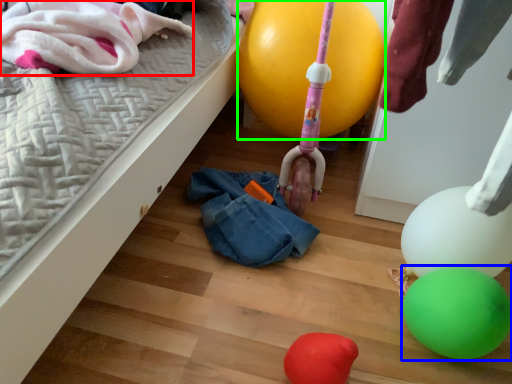
Question: Which object is positioned closest to clothing (highlighted by a red box)? Select from balloon (highlighted by a blue box) and balloon (highlighted by a green box).

Choices:
 (A) balloon
 (B) balloon

Answer: (B)